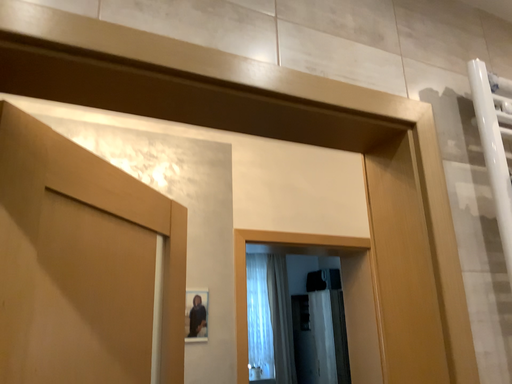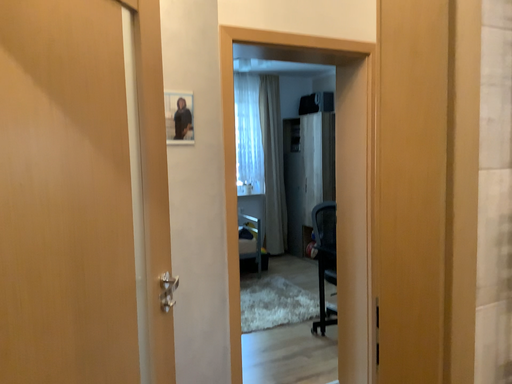
Question: Which way did the camera rotate in the video?

Choices:
 (A) rotated upward
 (B) rotated downward

Answer: (B)